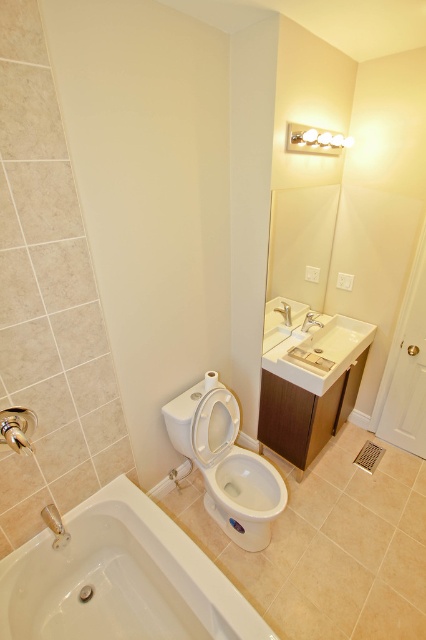
Question: Does satin nickel faucet at sink right have a smaller size compared to silver metallic faucet at upper center?

Choices:
 (A) no
 (B) yes

Answer: (B)

Question: Which object is farther from the camera taking this photo?

Choices:
 (A) white ceramic sink at center
 (B) white glossy light fixture at upper center

Answer: (A)

Question: In this image, where is white glossy toilet bowl at lower center located relative to satin nickel faucet at sink right?

Choices:
 (A) right
 (B) left

Answer: (B)

Question: Which object is closer to the camera taking this photo?

Choices:
 (A) white glossy bathtub at lower left
 (B) white ceramic sink at center
 (C) silver metallic faucet at upper center

Answer: (A)

Question: Can you confirm if white glossy toilet bowl at lower center is smaller than satin nickel faucet at sink right?

Choices:
 (A) no
 (B) yes

Answer: (A)

Question: Which point is farther to the camera?

Choices:
 (A) [103, 616]
 (B) [261, 477]
 (C) [313, 131]

Answer: (B)